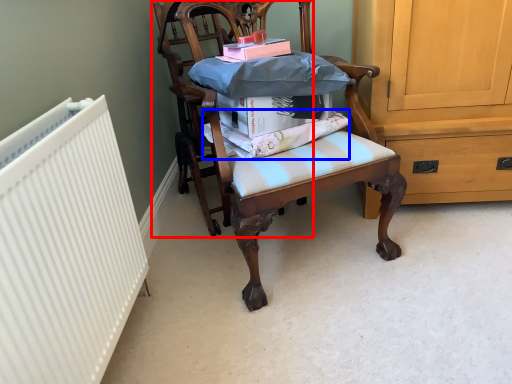
Question: Which object appears farthest to the camera in this image, chair (highlighted by a red box) or fabric (highlighted by a blue box)?

Choices:
 (A) chair
 (B) fabric

Answer: (A)